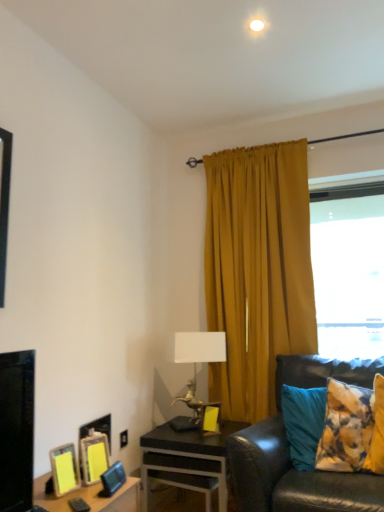
Question: Which direction should I rotate to face yellow matte picture frame at center, which appears as the 5th picture frame when viewed from the front, — up or down?

Choices:
 (A) up
 (B) down

Answer: (B)

Question: Is yellow matte picture frame at lower left, the third picture frame from the left, behind mustard fabric curtain at upper right?

Choices:
 (A) yes
 (B) no

Answer: (B)

Question: From the image's perspective, is yellow matte picture frame at lower left, marked as the third picture frame in a front-to-back arrangement, on mustard fabric curtain at upper right?

Choices:
 (A) no
 (B) yes

Answer: (A)

Question: Considering the relative positions of yellow matte picture frame at lower left, the third picture frame from the left, and mustard fabric curtain at upper right in the image provided, is yellow matte picture frame at lower left, the third picture frame from the left, in front of mustard fabric curtain at upper right?

Choices:
 (A) yes
 (B) no

Answer: (A)

Question: Is yellow matte picture frame at lower left, which is the third picture frame in back-to-front order, to the left of mustard fabric curtain at upper right from the viewer's perspective?

Choices:
 (A) yes
 (B) no

Answer: (A)

Question: Is yellow matte picture frame at lower left, marked as the third picture frame in a front-to-back arrangement, turned away from mustard fabric curtain at upper right?

Choices:
 (A) no
 (B) yes

Answer: (A)

Question: Considering the relative sizes of yellow matte picture frame at lower left, marked as the third picture frame in a front-to-back arrangement, and mustard fabric curtain at upper right in the image provided, is yellow matte picture frame at lower left, marked as the third picture frame in a front-to-back arrangement, smaller than mustard fabric curtain at upper right?

Choices:
 (A) no
 (B) yes

Answer: (B)

Question: Does matte yellow picture frame at lower left, the 1th picture frame from the front, touch mustard fabric curtain at upper right?

Choices:
 (A) no
 (B) yes

Answer: (A)

Question: Is matte yellow picture frame at lower left, the 5th picture frame when ordered from back to front, to the right of mustard fabric curtain at upper right from the viewer's perspective?

Choices:
 (A) yes
 (B) no

Answer: (B)

Question: Does matte yellow picture frame at lower left, the 5th picture frame when ordered from back to front, come in front of mustard fabric curtain at upper right?

Choices:
 (A) yes
 (B) no

Answer: (A)

Question: Would you say mustard fabric curtain at upper right is part of matte yellow picture frame at lower left, which is the fourth picture frame in left-to-right order,'s contents?

Choices:
 (A) yes
 (B) no

Answer: (B)

Question: Does matte yellow picture frame at lower left, the 5th picture frame when ordered from back to front, have a lesser width compared to mustard fabric curtain at upper right?

Choices:
 (A) yes
 (B) no

Answer: (A)

Question: Does matte yellow picture frame at lower left, which is the fourth picture frame in left-to-right order, have a smaller size compared to mustard fabric curtain at upper right?

Choices:
 (A) no
 (B) yes

Answer: (B)

Question: Can you confirm if metallic horse-shaped lamp at center is smaller than black leather couch at right?

Choices:
 (A) yes
 (B) no

Answer: (A)